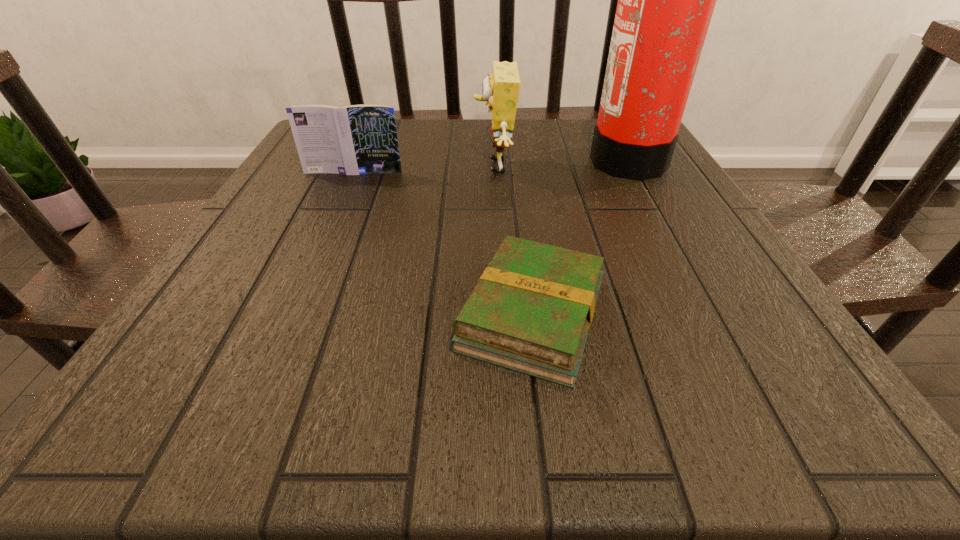
You are a GUI agent. You are given a task and a screenshot of the screen. Output one action in this format:
    pyautogui.click(x=<x>, y=<y>)
    Task: Click on the unoccupied area between the right book and the taller book
    Image resolution: width=960 pixels, height=540 pixels.
    Given the screenshot: What is the action you would take?
    pyautogui.click(x=443, y=244)

Locate an element on the screen. This screenshot has height=540, width=960. vacant region between the second shortest object and the second tallest object is located at coordinates (424, 170).

Where is `vacant space that's between the sponge and the tallest object`? Image resolution: width=960 pixels, height=540 pixels. vacant space that's between the sponge and the tallest object is located at coordinates (561, 163).

You are a GUI agent. You are given a task and a screenshot of the screen. Output one action in this format:
    pyautogui.click(x=<x>, y=<y>)
    Task: Click on the empty space that is in between the rightmost object and the nearer book
    The width and height of the screenshot is (960, 540).
    Given the screenshot: What is the action you would take?
    pos(579,237)

Point out which object is positioned as the nearest to the sponge. Please provide its 2D coordinates. Your answer should be formatted as a tuple, i.e. [(x, y)], where the tuple contains the x and y coordinates of a point satisfying the conditions above.

[(358, 139)]

Select which object appears as the third closest to the sponge. Please provide its 2D coordinates. Your answer should be formatted as a tuple, i.e. [(x, y)], where the tuple contains the x and y coordinates of a point satisfying the conditions above.

[(531, 311)]

The height and width of the screenshot is (540, 960). I want to click on free point that satisfies the following two spatial constraints: 1. on the front side of the rightmost object; 2. on the front cover of the third tallest object, so click(x=635, y=172).

Find the location of `vacant space that satisfies the following two spatial constraints: 1. on the front cover of the right book; 2. on the left side of the second shortest object`. vacant space that satisfies the following two spatial constraints: 1. on the front cover of the right book; 2. on the left side of the second shortest object is located at coordinates (x=290, y=315).

Locate an element on the screen. This screenshot has width=960, height=540. vacant space that satisfies the following two spatial constraints: 1. on the face of the sponge; 2. on the front cover of the taller book is located at coordinates (494, 172).

This screenshot has width=960, height=540. What are the coordinates of `vacant position in the image that satisfies the following two spatial constraints: 1. on the front cover of the shorter book; 2. on the left side of the taller book` in the screenshot? It's located at point(290,315).